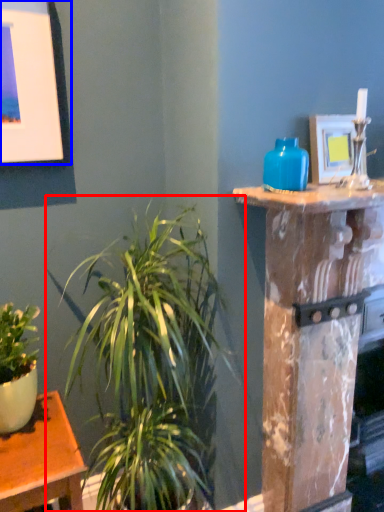
Question: Which object appears farthest to the camera in this image, houseplant (highlighted by a red box) or picture frame (highlighted by a blue box)?

Choices:
 (A) houseplant
 (B) picture frame

Answer: (B)